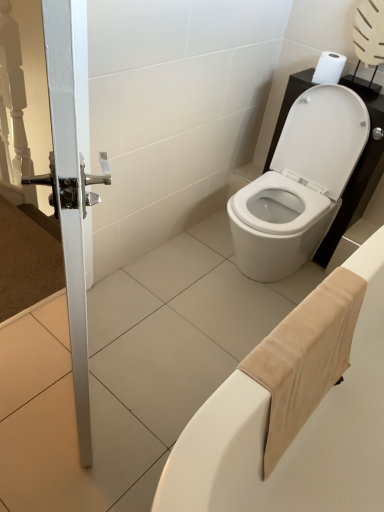
This screenshot has height=512, width=384. In order to click on white glossy door handle at left in this screenshot , I will do `click(78, 199)`.

Measure the distance between white matte toilet paper at upper right and camera.

A distance of 1.77 meters exists between white matte toilet paper at upper right and camera.

Where is `white glossy door handle at left`? This screenshot has height=512, width=384. white glossy door handle at left is located at coordinates (78, 199).

Is beige fabric towel at lower right facing towards white matte toilet paper at upper right?

No, beige fabric towel at lower right is not aimed at white matte toilet paper at upper right.

Does beige fabric towel at lower right appear on the left side of white matte toilet paper at upper right?

Correct, you'll find beige fabric towel at lower right to the left of white matte toilet paper at upper right.

Considering the relative sizes of beige fabric towel at lower right and white matte toilet paper at upper right in the image provided, is beige fabric towel at lower right thinner than white matte toilet paper at upper right?

No, beige fabric towel at lower right is not thinner than white matte toilet paper at upper right.

Which is farther from the camera, (230,423) or (318,68)?

Positioned behind is point (318,68).

Considering the relative positions of white glossy toilet at center and white matte toilet paper at upper right in the image provided, is white glossy toilet at center to the right of white matte toilet paper at upper right from the viewer's perspective?

Incorrect, white glossy toilet at center is not on the right side of white matte toilet paper at upper right.

Is white glossy toilet at center not inside white matte toilet paper at upper right?

That's correct, white glossy toilet at center is outside of white matte toilet paper at upper right.

From the image's perspective, is white glossy toilet at center beneath white matte toilet paper at upper right?

Correct, white glossy toilet at center appears lower than white matte toilet paper at upper right in the image.

In the image, is white glossy toilet at center positioned in front of or behind white matte toilet paper at upper right?

In the image, white glossy toilet at center appears in front of white matte toilet paper at upper right.

Is white glossy door handle at left far from beige fabric towel at lower right?

No.

Considering the relative sizes of white glossy door handle at left and beige fabric towel at lower right in the image provided, is white glossy door handle at left shorter than beige fabric towel at lower right?

Incorrect, the height of white glossy door handle at left does not fall short of that of beige fabric towel at lower right.

Is white glossy door handle at left to the left of beige fabric towel at lower right from the viewer's perspective?

Yes.

Could you tell me if white matte toilet paper at upper right is turned towards white glossy toilet at center?

No, white matte toilet paper at upper right is not facing towards white glossy toilet at center.

How distant is white matte toilet paper at upper right from white glossy toilet at center?

They are 17.25 inches apart.

From the picture: Is white matte toilet paper at upper right to the left of white glossy toilet at center from the viewer's perspective?

Incorrect, white matte toilet paper at upper right is not on the left side of white glossy toilet at center.

Considering the positions of objects white matte toilet paper at upper right and white glossy toilet at center in the image provided, who is in front, white matte toilet paper at upper right or white glossy toilet at center?

white glossy toilet at center is closer to the camera.

Are white glossy door handle at left and white glossy toilet at center beside each other?

They are not placed beside each other.

Which object is closer to the camera, white glossy door handle at left or white glossy toilet at center?

white glossy door handle at left is more forward.

Can white glossy toilet at center be found inside white glossy door handle at left?

No, white glossy toilet at center is not inside white glossy door handle at left.

Which is less distant, (80, 321) or (330, 177)?

Point (80, 321) is closer to the camera than point (330, 177).

Is white glossy toilet at center far away from white glossy door handle at left?

white glossy toilet at center is far away from white glossy door handle at left.

In the scene shown: Is white glossy toilet at center turned away from white glossy door handle at left?

white glossy toilet at center is not turned away from white glossy door handle at left.

From a real-world perspective, who is located higher, white glossy toilet at center or white glossy door handle at left?

From a 3D spatial view, white glossy door handle at left is above.

From the image's perspective, is white matte toilet paper at upper right located above beige fabric towel at lower right?

Yes, from the image's perspective, white matte toilet paper at upper right is over beige fabric towel at lower right.

Looking at the image, does white matte toilet paper at upper right seem bigger or smaller compared to beige fabric towel at lower right?

white matte toilet paper at upper right is smaller than beige fabric towel at lower right.

Would you say white matte toilet paper at upper right is to the left or to the right of beige fabric towel at lower right in the picture?

In the image, white matte toilet paper at upper right appears on the right side of beige fabric towel at lower right.

Identify the location of toilet paper that appears on the right of beige fabric towel at lower right. This screenshot has height=512, width=384. (329, 68).

Locate an element on the screen. toilet paper that is above the beige fabric towel at lower right (from the image's perspective) is located at coordinates coord(329,68).

This screenshot has height=512, width=384. Find the location of `toilet that is under the white matte toilet paper at upper right (from a real-world perspective)`. toilet that is under the white matte toilet paper at upper right (from a real-world perspective) is located at coordinates (299, 184).

Looking at this image, which object lies nearer to the anchor point beige fabric towel at lower right, white matte toilet paper at upper right or white glossy toilet at center?

white glossy toilet at center lies closer to beige fabric towel at lower right than the other object.

When comparing their distances from white matte toilet paper at upper right, does beige fabric towel at lower right or white glossy toilet at center seem further?

beige fabric towel at lower right lies further to white matte toilet paper at upper right than the other object.

Looking at the image, which one is located further to beige fabric towel at lower right, white glossy door handle at left or white matte toilet paper at upper right?

Among the two, white matte toilet paper at upper right is located further to beige fabric towel at lower right.

In the scene shown: Looking at the image, which one is located further to white glossy door handle at left, beige fabric towel at lower right or white matte toilet paper at upper right?

Among the two, white matte toilet paper at upper right is located further to white glossy door handle at left.

When comparing their distances from white glossy door handle at left, does white glossy toilet at center or beige fabric towel at lower right seem closer?

Based on the image, beige fabric towel at lower right appears to be nearer to white glossy door handle at left.

Looking at this image, based on their spatial positions, is white matte toilet paper at upper right or beige fabric towel at lower right further from white glossy door handle at left?

white matte toilet paper at upper right lies further to white glossy door handle at left than the other object.

Estimate the real-world distances between objects in this image. Which object is closer to white matte toilet paper at upper right, white glossy door handle at left or beige fabric towel at lower right?

The object closer to white matte toilet paper at upper right is beige fabric towel at lower right.

Looking at the image, which one is located closer to white glossy toilet at center, beige fabric towel at lower right or white matte toilet paper at upper right?

Answer: white matte toilet paper at upper right.

Find the location of a particular element. This screenshot has width=384, height=512. bath between white glossy door handle at left and white matte toilet paper at upper right from front to back is located at coordinates (297, 436).

Locate an element on the screen. toilet positioned between white glossy door handle at left and white matte toilet paper at upper right from near to far is located at coordinates (299, 184).

The height and width of the screenshot is (512, 384). I want to click on bath located between white glossy door handle at left and white glossy toilet at center in the depth direction, so click(x=297, y=436).

The image size is (384, 512). I want to click on toilet positioned between beige fabric towel at lower right and white matte toilet paper at upper right from near to far, so click(299, 184).